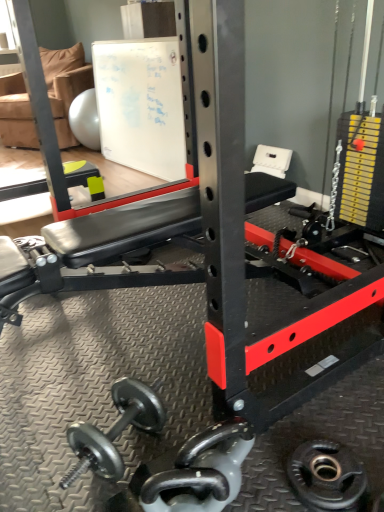
Find the location of a particular element. empty space that is to the right of polished silver dumbbell at center is located at coordinates (275, 464).